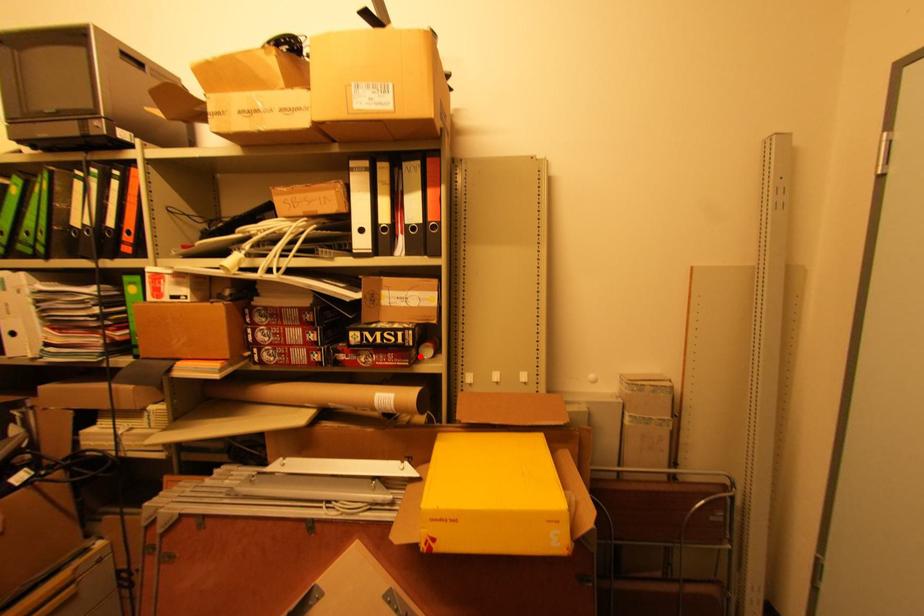
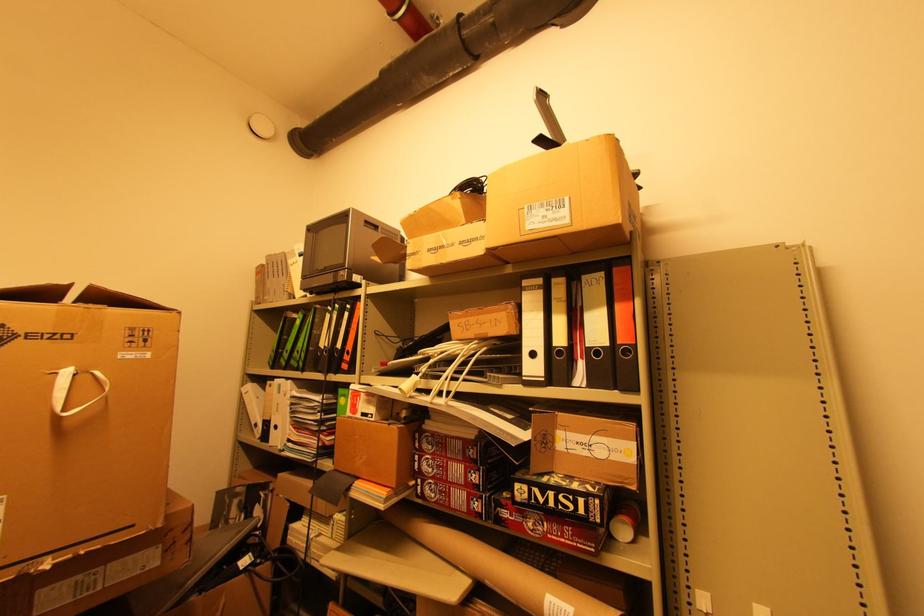
The point at the highlighted location is marked in the first image. Where is the corresponding point in the second image?

(611, 535)